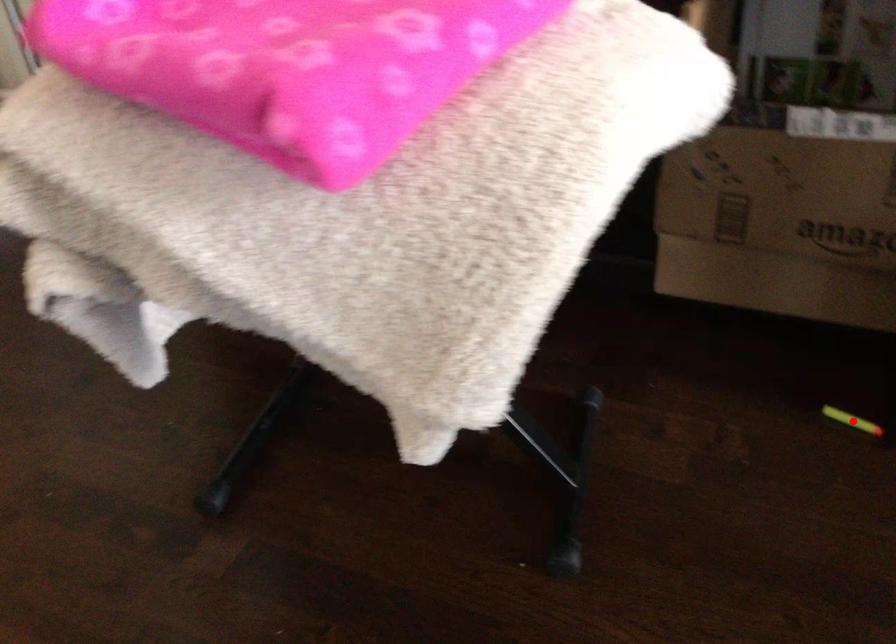
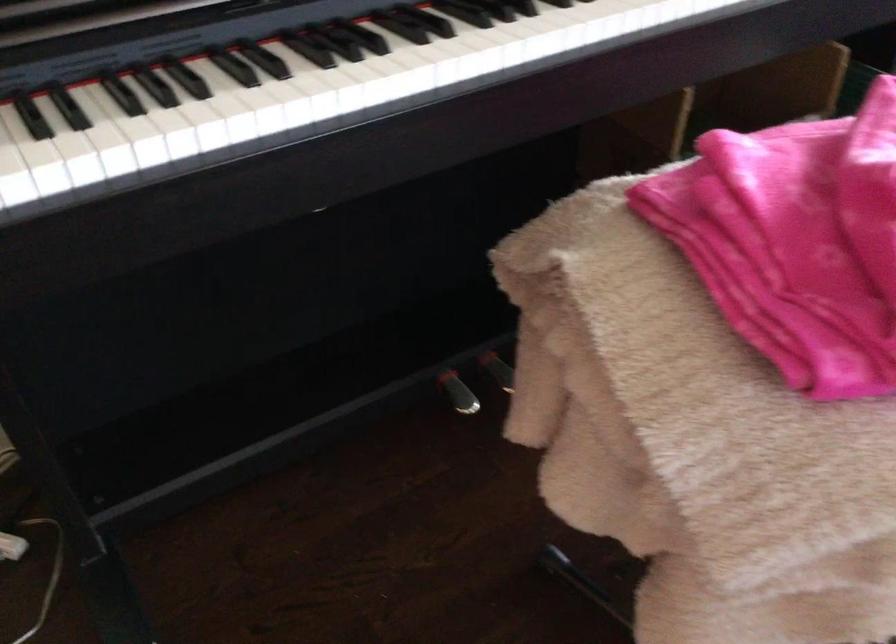
Question: I am providing you with two images of the same scene from different viewpoints. A red point is marked on the first image. Can you still see the location of the red point in image 2?

Choices:
 (A) Yes
 (B) No

Answer: (B)